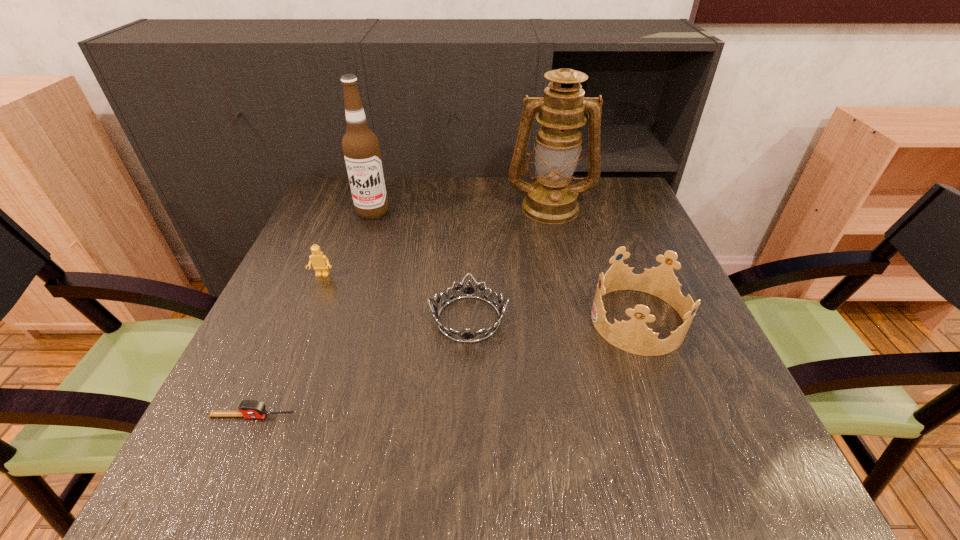
Find the location of a particular element. Image resolution: width=960 pixels, height=540 pixels. empty space between the shortest object and the oil lamp is located at coordinates (401, 312).

This screenshot has width=960, height=540. Identify the location of object that is the second closest to the right tiara. (551, 199).

Identify the location of object that stands as the fourth closest to the Lego. (551, 199).